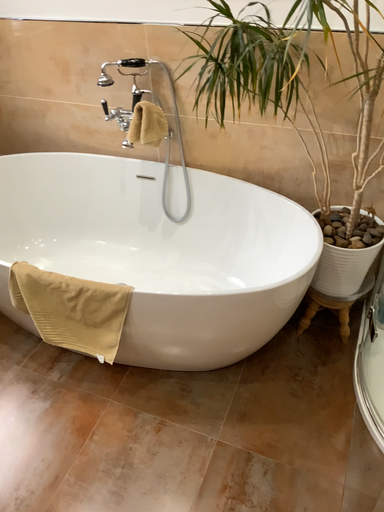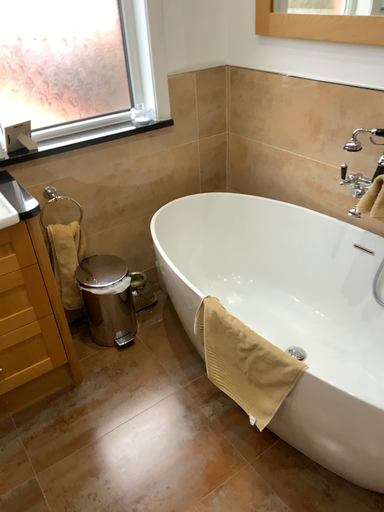
Question: Which way did the camera rotate in the video?

Choices:
 (A) rotated upward
 (B) rotated downward

Answer: (A)